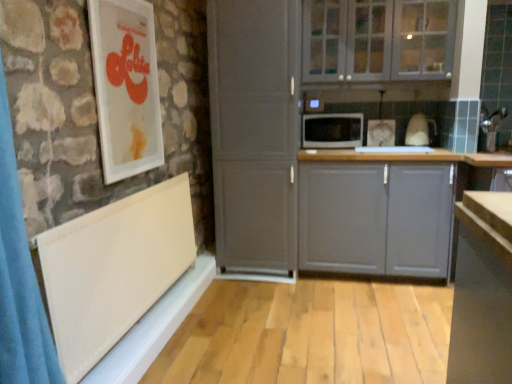
At what (x,y) coordinates should I click in order to perform the action: click on free spot to the right of white textured window sill at lower left. Please return your answer as a coordinate pair (x, y). This screenshot has height=384, width=512. Looking at the image, I should click on (286, 325).